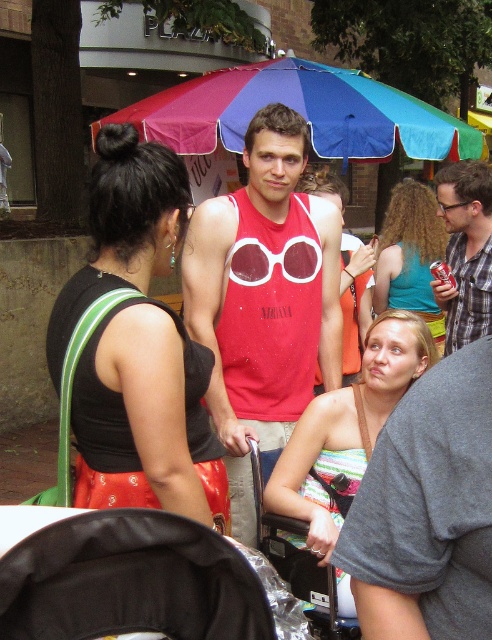
Describe the element at coordinates (129, 580) in the screenshot. This screenshot has height=640, width=492. I see `black fabric baby carriage at lower left` at that location.

Does black fabric baby carriage at lower left have a larger size compared to matte plastic goggles at center?

Yes, black fabric baby carriage at lower left is bigger than matte plastic goggles at center.

Locate an element on the screen. Image resolution: width=492 pixels, height=640 pixels. black fabric baby carriage at lower left is located at coordinates (129, 580).

I want to click on black fabric baby carriage at lower left, so click(129, 580).

The image size is (492, 640). What do you see at coordinates (147, 417) in the screenshot? I see `black fabric tank top at center` at bounding box center [147, 417].

Between point (175, 224) and point (461, 236), which one is positioned in front?

Point (175, 224) is in front.

Is point (145, 292) positioned behind point (473, 212)?

No, (145, 292) is closer to viewer.

Where is `black fabric tank top at center`? black fabric tank top at center is located at coordinates (147, 417).

Who is positioned more to the right, black fabric tank top at center or striped fabric dress at center?

striped fabric dress at center is more to the right.

Between black fabric tank top at center and striped fabric dress at center, which one is positioned higher?

black fabric tank top at center

The image size is (492, 640). Find the location of `black fabric tank top at center`. black fabric tank top at center is located at coordinates (147, 417).

Locate an element on the screen. The height and width of the screenshot is (640, 492). black fabric tank top at center is located at coordinates (147, 417).